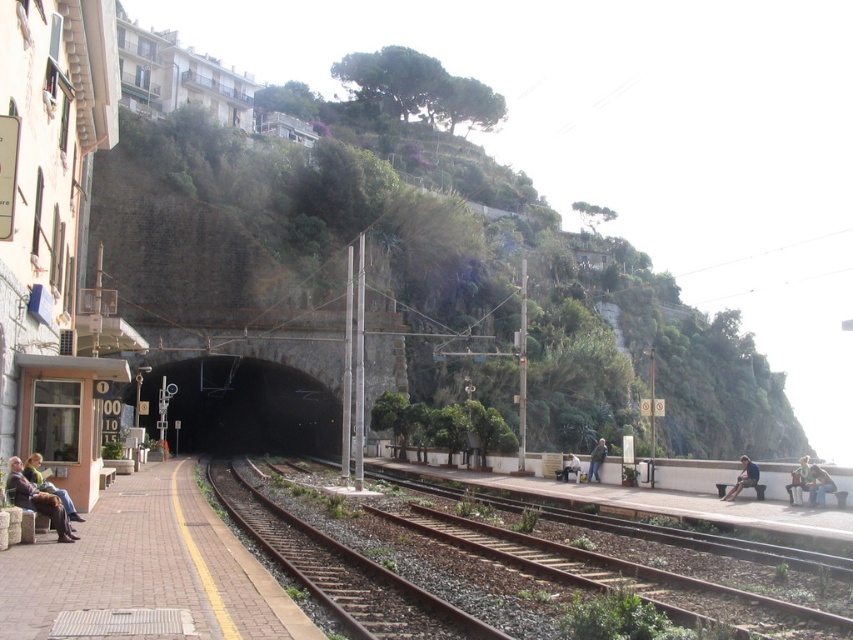
You are standing on the railway station platform and want to walk from point (767, 621) to point (247, 433). Which direction should you face to move towards the correct destination?

You should face towards the lower left direction because point (247, 433) is further away from the viewer compared to point (767, 621).

You are a maintenance worker needing to inspect the rusty metal tracks at center and the black concrete tunnel at center. Which object should you check first if you are approaching from the front of the tunnel?

You should check the rusty metal tracks at center first because they are in front of the black concrete tunnel at center, so they are closer to your current position when approaching from the front of the tunnel.

You are a commuter waiting at the station and see both the leather jacket at lower left and the light blue denim jacket at center. Which jacket is positioned higher relative to the other?

The leather jacket at lower left is located above the light blue denim jacket at center, so it is positioned higher.